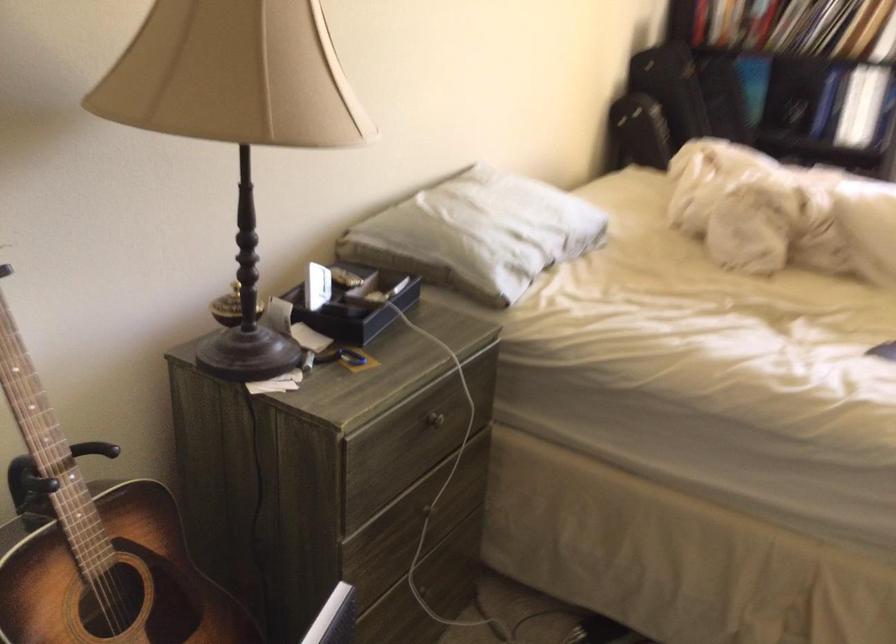
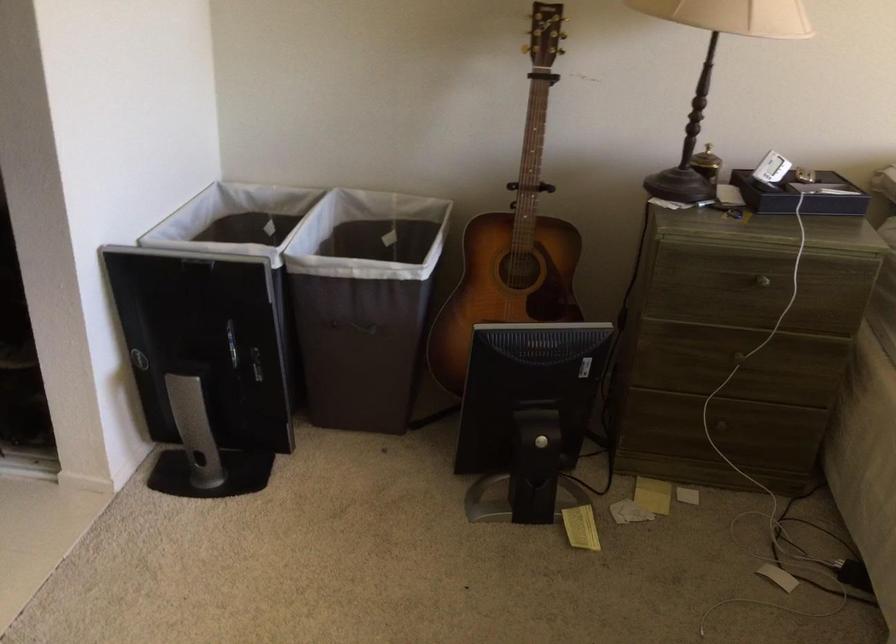
Where in the second image is the point corresponding to (437,419) from the first image?

(762, 281)